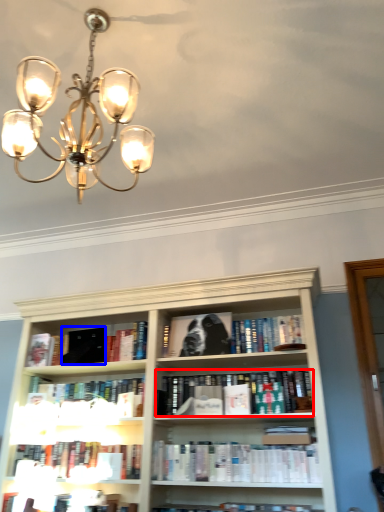
Question: Which object is closer to the camera taking this photo, book (highlighted by a red box) or paperback book (highlighted by a blue box)?

Choices:
 (A) book
 (B) paperback book

Answer: (A)